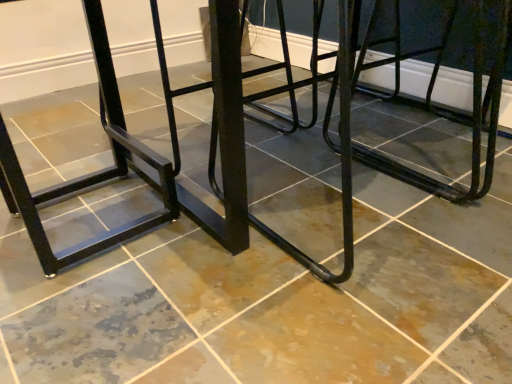
Identify the location of vacant space underneath black matte metal bar stool at left (from a real-world perspective). The width and height of the screenshot is (512, 384). (81, 218).